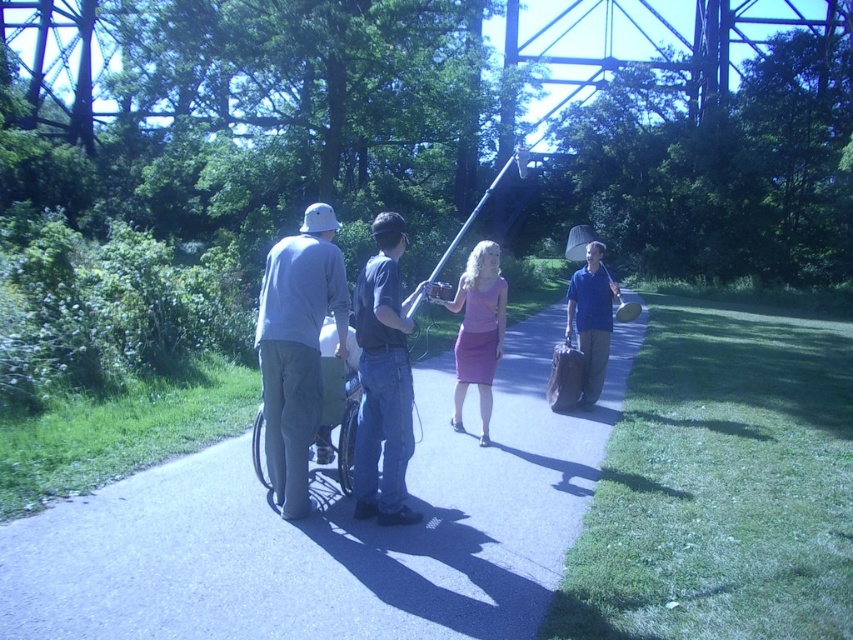
You are a photographer standing on the asphalt pavement at center, and you want to take a photo of the purple satin dress at center. Considering your camera has a maximum focus range of 3 meters, will you be able to capture the dress clearly without moving?

The distance between the asphalt pavement at center and the purple satin dress at center is 2.84 meters, which is within the camera maximum focus range of 3 meters. Therefore, you can capture the dress clearly without moving.